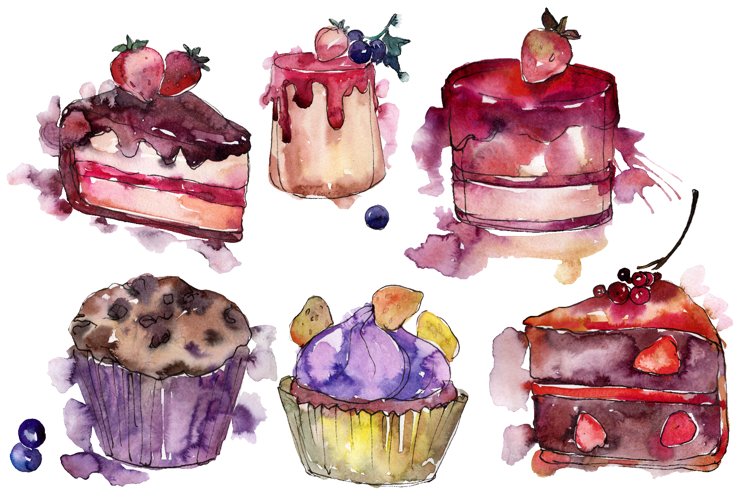
Locate an element on the screen. This screenshot has width=750, height=500. watercolor paintings of cakes and cupcakes is located at coordinates (168, 169), (334, 134), (534, 155), (616, 375), (376, 412), (177, 400).